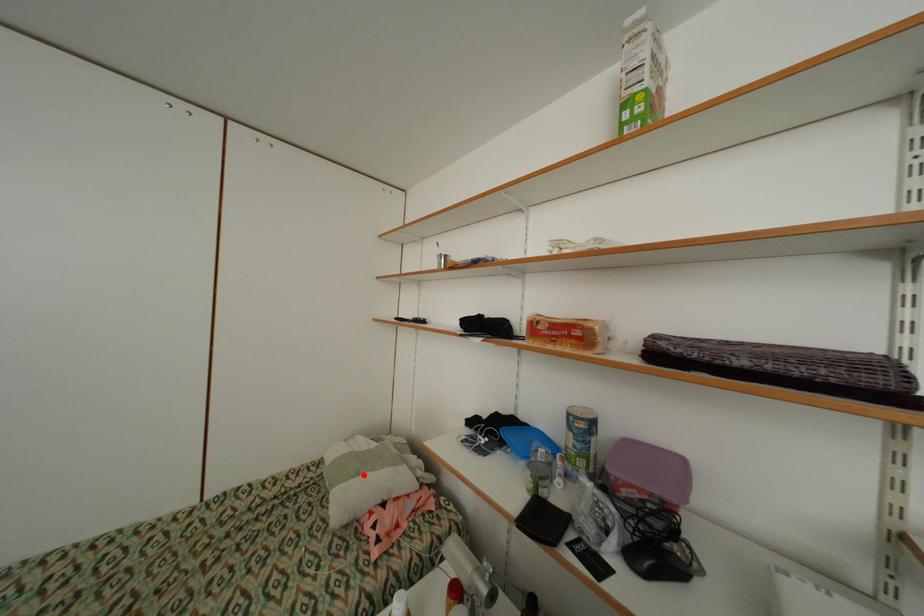
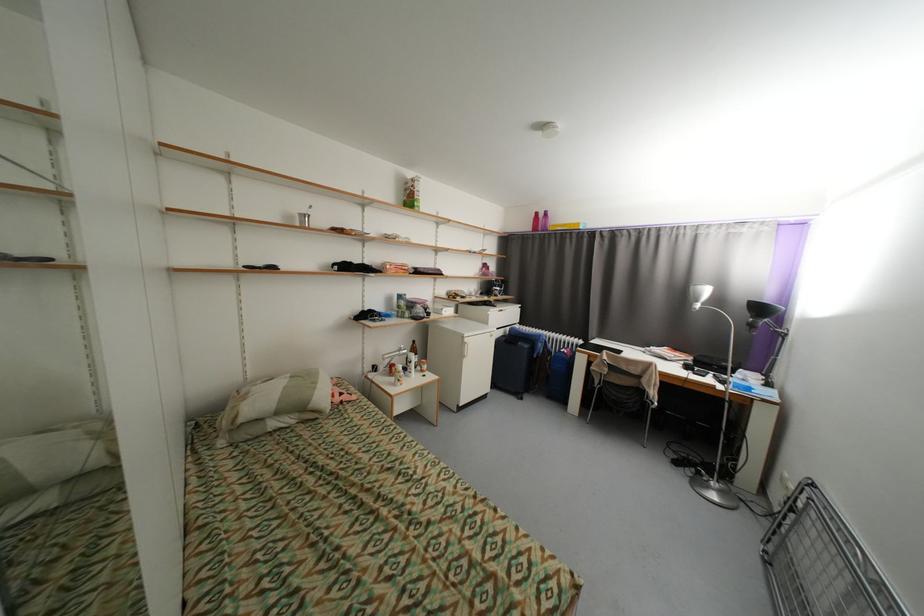
Question: A red point is marked in image1. In image2, is the corresponding 3D point closer to the camera or farther? Reply with the corresponding letter.

Choices:
 (A) The corresponding 3D point is closer.
 (B) The corresponding 3D point is farther.

Answer: (A)